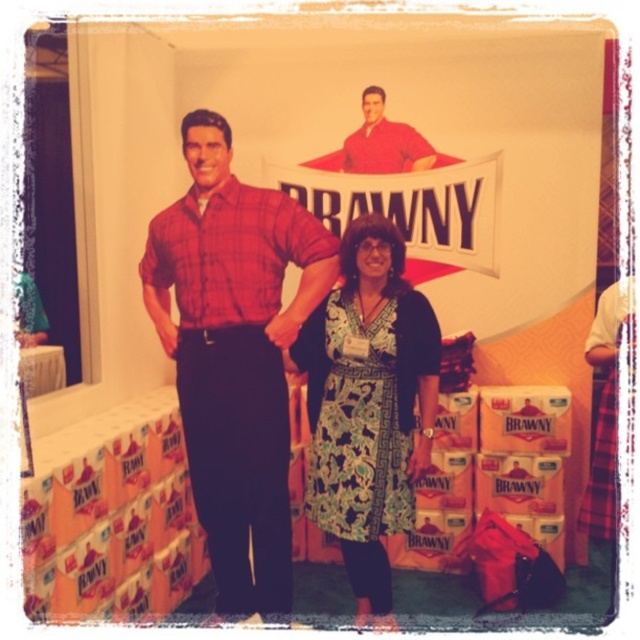
You are a photographer setting up for a photoshoot at the Brawny promotional setup. You need to ensure that the printed fabric dress at center and the matte red shirt at center are both visible in the frame. Given their widths, which object should you adjust to avoid cropping either one?

The printed fabric dress at center is wider than the matte red shirt at center, so you should adjust the camera angle or frame to accommodate the wider printed fabric dress at center first to ensure it fits without cropping.

You are standing in front of the promotional setup for Brawny paper towels. You see a point at coordinates (368, 404). What object is located at this point?

The point at coordinates (368, 404) corresponds to the printed fabric dress at center.

You are a photographer setting up for a product shoot. You need to place a 14 inch wide decorative frame between the plaid shirt at center and the printed fabric dress at center. Will there be enough space between them to fit the frame?

The plaid shirt at center and printed fabric dress at center are 12.84 inches apart from each other. Since the frame is 14 inches wide, it will not fit between them as the space is narrower than the frame.